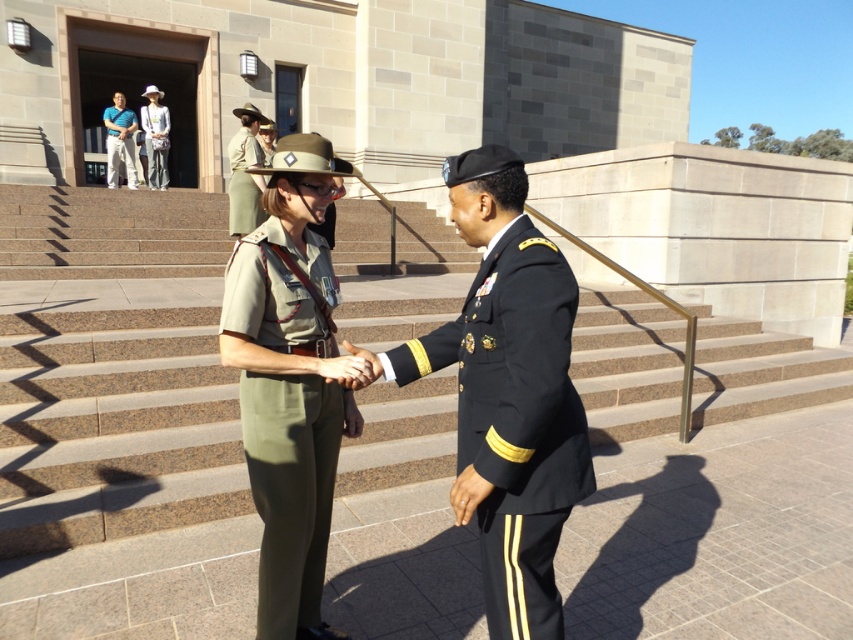
You are standing at the base of the stone steps leading to the public building. You notice two points marked on the ground ahead of you. The first point is at coordinate point (x=28, y=339) and the second is at point (x=117, y=100). If you want to reach the point that is closer to the entrance of the building, which coordinate should you head towards?

Point (x=28, y=339) is in front of point (x=117, y=100), so you should head towards point (x=28, y=339) to reach the one closer to the entrance.

You are a photographer positioned at the bottom of the steps. You need to capture a photo that includes both the green fabric uniform at center and the blue cotton shirt at upper left. Which object should you adjust your camera angle to focus on first to ensure both are in frame?

The green fabric uniform at center is below the blue cotton shirt at upper left, so you should first focus on the blue cotton shirt at upper left to ensure both are visible in the frame.

In the scene shown: You are standing at the bottom of the brown stone stairs at center and want to greet the person wearing the blue cotton shirt at upper left. Which direction should you move to get closer to them?

You should move upward along the brown stone stairs at center because they are closer to you than the blue cotton shirt at upper left, which is located higher up on the stairs.